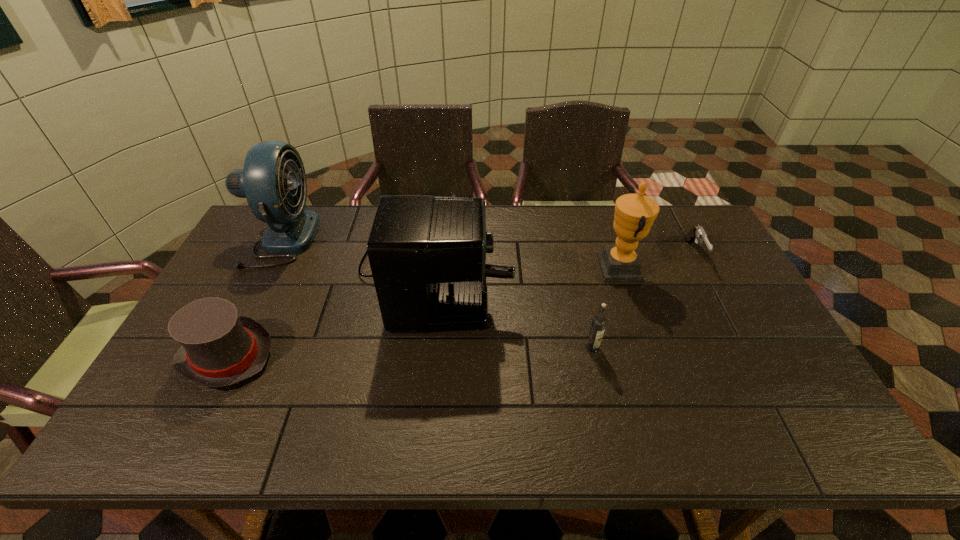
I want to click on empty location between the coffee maker and the dress hat, so click(331, 310).

This screenshot has height=540, width=960. What are the coordinates of `vacant point located between the rightmost object and the award` in the screenshot? It's located at (657, 261).

This screenshot has height=540, width=960. In order to click on object that is the fifth nearest to the fourth tallest object in this screenshot , I will do [x=271, y=167].

Where is `the fourth closest object to the dress hat`? The image size is (960, 540). the fourth closest object to the dress hat is located at coordinates (634, 215).

The image size is (960, 540). In order to click on free space that satisfies the following two spatial constraints: 1. at the front of the award with handles; 2. on the label of the vodka in this screenshot , I will do `click(645, 348)`.